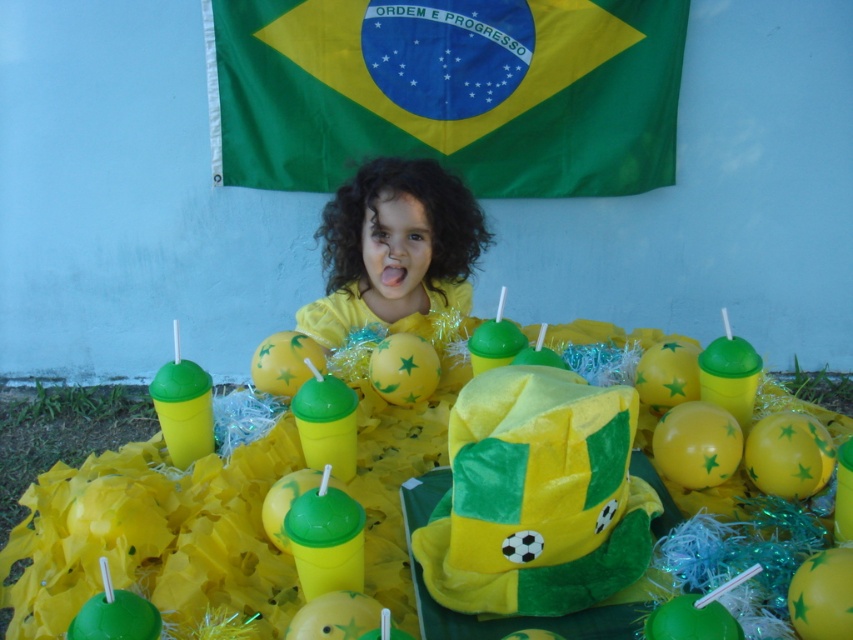
Looking at this image, you are at a Brazilian festival and want to take a photo with both the green fabric flag at upper center and the yellow matte shirt at center. Since you want the flag to look more prominent in the photo, where should you stand relative to the shirt?

To make the green fabric flag at upper center look more prominent in the photo, you should stand closer to the flag than the yellow matte shirt at center because the flag is already bigger than the shirt. This way, the flag will appear even larger relative to the shirt in the photo.

You are at a Brazilian themed party and see the green fabric flag at upper center and the yellow matte shirt at center. Which object is taller?

The green fabric flag at upper center is taller than the yellow matte shirt at center.